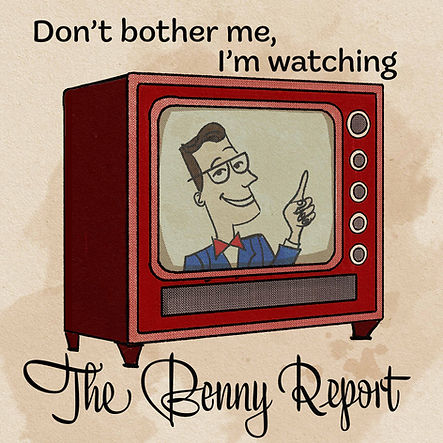
The width and height of the screenshot is (443, 443). In order to click on television legs in this screenshot , I will do `click(129, 355)`, `click(69, 343)`, `click(361, 326)`.